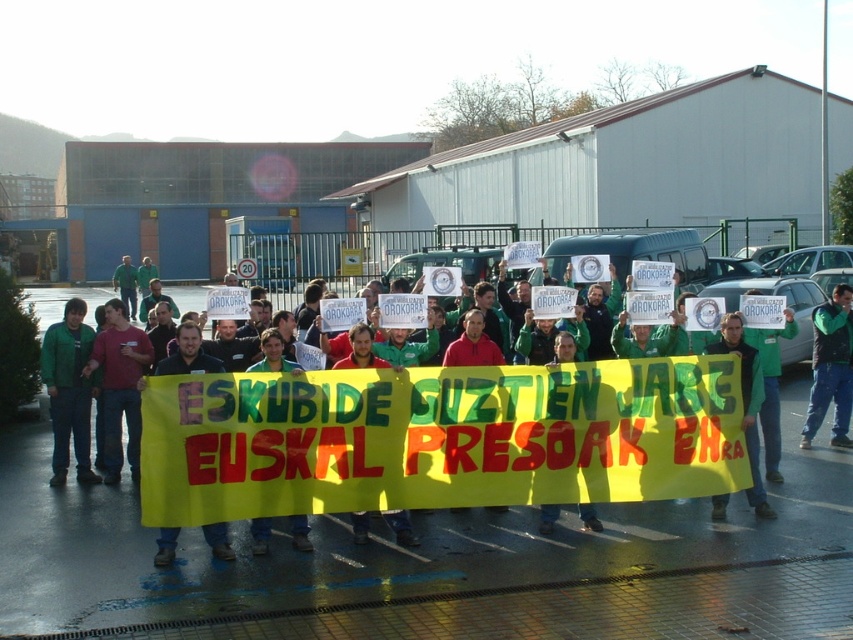
Question: Does green fleece jacket at center appear over green fabric banner at center?

Choices:
 (A) yes
 (B) no

Answer: (B)

Question: Does green matte jacket at left lie in front of green fabric sign at center?

Choices:
 (A) yes
 (B) no

Answer: (B)

Question: Which point is farther to the camera?

Choices:
 (A) dark red shirt at center
 (B) green fleece jacket at center
 (C) green fabric banner at center
 (D) yellow fabric banner at center

Answer: (B)

Question: Among these objects, which one is farthest from the camera?

Choices:
 (A) green fabric sign at center
 (B) yellow fabric banner at center
 (C) green fleece jacket at center
 (D) green fabric banner at center

Answer: (C)

Question: Which of the following is the closest to the observer?

Choices:
 (A) yellow fabric banner at center
 (B) green matte jacket at left
 (C) dark red shirt at center
 (D) green fleece jacket at center

Answer: (A)

Question: Can you confirm if yellow fabric banner at center is positioned above green fabric banner at center?

Choices:
 (A) no
 (B) yes

Answer: (A)